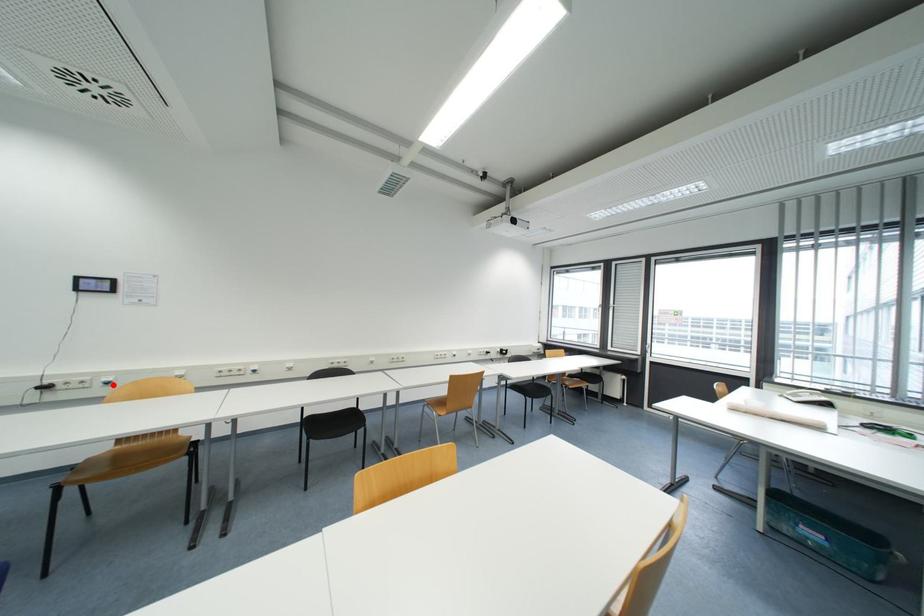
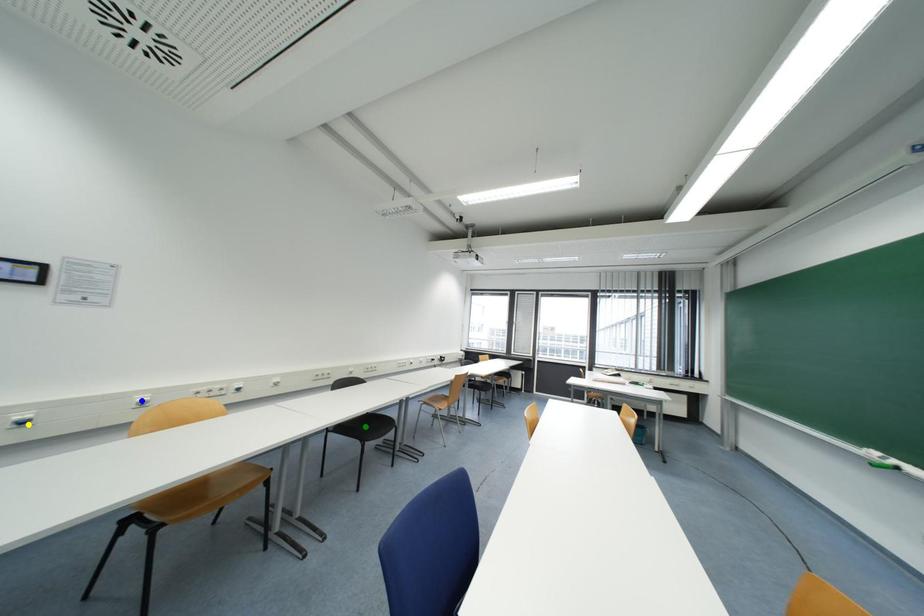
Question: I am providing you with two images of the same scene from different viewpoints. A red point is marked on the first image. You are given multiple points on the second image. Which point in image 2 is actually the same real-world point as the red point in image 1?

Choices:
 (A) green point
 (B) blue point
 (C) yellow point

Answer: (C)